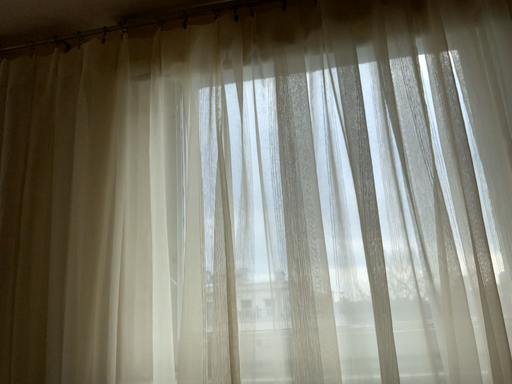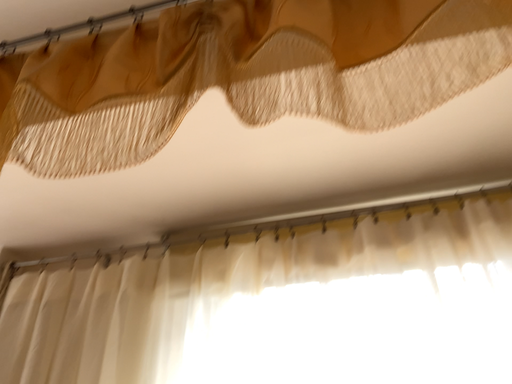
Question: How did the camera likely rotate when shooting the video?

Choices:
 (A) rotated downward
 (B) rotated upward

Answer: (B)